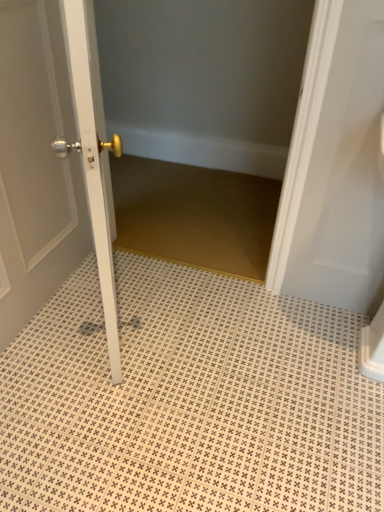
Identify the location of white textured tile at center. The height and width of the screenshot is (512, 384). (188, 401).

What do you see at coordinates (188, 401) in the screenshot?
I see `white textured tile at center` at bounding box center [188, 401].

What do you see at coordinates (37, 163) in the screenshot? I see `white glossy door at center` at bounding box center [37, 163].

Identify the location of white glossy door at center. This screenshot has width=384, height=512. (37, 163).

Locate an element on the screen. white textured tile at center is located at coordinates (188, 401).

Which is more to the right, white textured tile at center or white glossy door at center?

From the viewer's perspective, white textured tile at center appears more on the right side.

Is white textured tile at center in front of or behind white glossy door at center in the image?

Clearly, white textured tile at center is behind white glossy door at center.

Is point (228, 432) closer to viewer compared to point (45, 140)?

Yes, it is.

From the image's perspective, is white textured tile at center located above white glossy door at center?

No.

From a real-world perspective, is white textured tile at center positioned above or below white glossy door at center?

From a real-world perspective, white textured tile at center is physically below white glossy door at center.

Which of these two, white textured tile at center or white glossy door at center, is wider?

white textured tile at center.

Considering the relative sizes of white textured tile at center and white glossy door at center in the image provided, is white textured tile at center shorter than white glossy door at center?

Yes, white textured tile at center is shorter than white glossy door at center.

Between white textured tile at center and white glossy door at center, which one has larger size?

With larger size is white textured tile at center.

Consider the image. Is white textured tile at center positioned beyond the bounds of white glossy door at center?

white textured tile at center is positioned outside white glossy door at center.

Does white textured tile at center touch white glossy door at center?

white textured tile at center is not next to white glossy door at center, and they're not touching.

Is white textured tile at center oriented away from white glossy door at center?

No, white textured tile at center is not facing away from white glossy door at center.

Can you tell me how much white textured tile at center and white glossy door at center differ in facing direction?

The angular difference between white textured tile at center and white glossy door at center is 90 degrees.

Where is `ceramic tile behind the white glossy door at center`? Image resolution: width=384 pixels, height=512 pixels. ceramic tile behind the white glossy door at center is located at coordinates (188, 401).

Considering the positions of objects white glossy door at center and white textured tile at center in the image provided, who is more to the left, white glossy door at center or white textured tile at center?

From the viewer's perspective, white glossy door at center appears more on the left side.

Who is more distant, white glossy door at center or white textured tile at center?

Positioned behind is white textured tile at center.

Is point (96, 118) in front of point (203, 400)?

Yes, point (96, 118) is closer to viewer.

From the image's perspective, is white glossy door at center located beneath white textured tile at center?

Incorrect, from the image's perspective, white glossy door at center is higher than white textured tile at center.

From a real-world perspective, is white glossy door at center physically below white textured tile at center?

No, from a real-world perspective, white glossy door at center is not below white textured tile at center.

Is white glossy door at center wider or thinner than white textured tile at center?

In the image, white glossy door at center appears to be more narrow than white textured tile at center.

Is white glossy door at center taller than white textured tile at center?

Yes, white glossy door at center is taller than white textured tile at center.

Based on the photo, considering the sizes of objects white glossy door at center and white textured tile at center in the image provided, who is bigger, white glossy door at center or white textured tile at center?

white textured tile at center is bigger.

Could white textured tile at center be considered to be inside white glossy door at center?

No, white textured tile at center is not surrounded by white glossy door at center.

Is white glossy door at center directly adjacent to white textured tile at center?

No, white glossy door at center is not with white textured tile at center.

Is white glossy door at center facing towards white textured tile at center?

Yes, white glossy door at center is oriented towards white textured tile at center.

How many degrees apart are the facing directions of white glossy door at center and white textured tile at center?

The angle between the facing direction of white glossy door at center and the facing direction of white textured tile at center is 90 degrees.

At what (x,y) coordinates should I click in order to perform the action: click on door located above the white textured tile at center (from a real-world perspective). Please return your answer as a coordinate pair (x, y). The image size is (384, 512). Looking at the image, I should click on (37, 163).

Where is `ceramic tile lying behind the white glossy door at center`? The width and height of the screenshot is (384, 512). ceramic tile lying behind the white glossy door at center is located at coordinates (188, 401).

At what (x,y) coordinates should I click in order to perform the action: click on door on the left of white textured tile at center. Please return your answer as a coordinate pair (x, y). This screenshot has width=384, height=512. Looking at the image, I should click on (37, 163).